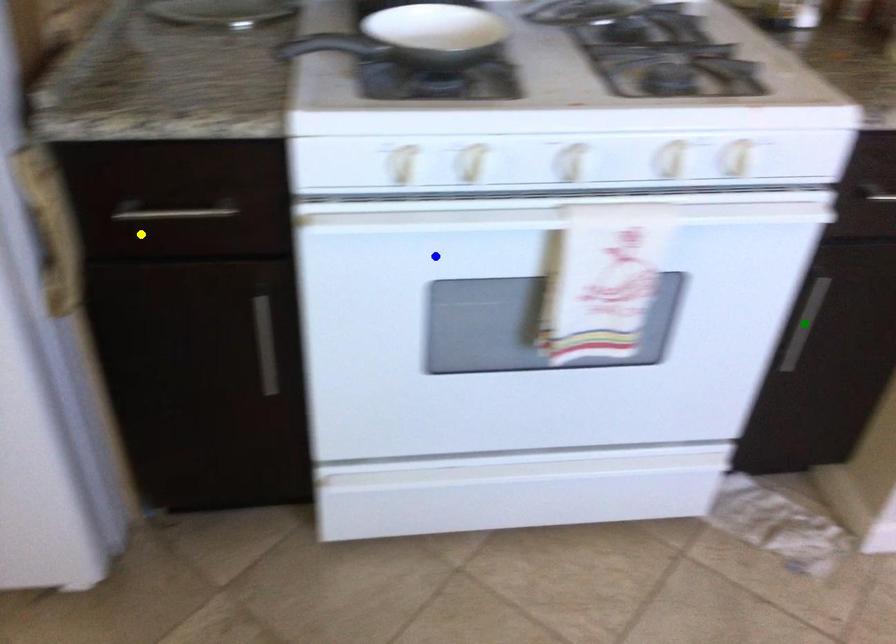
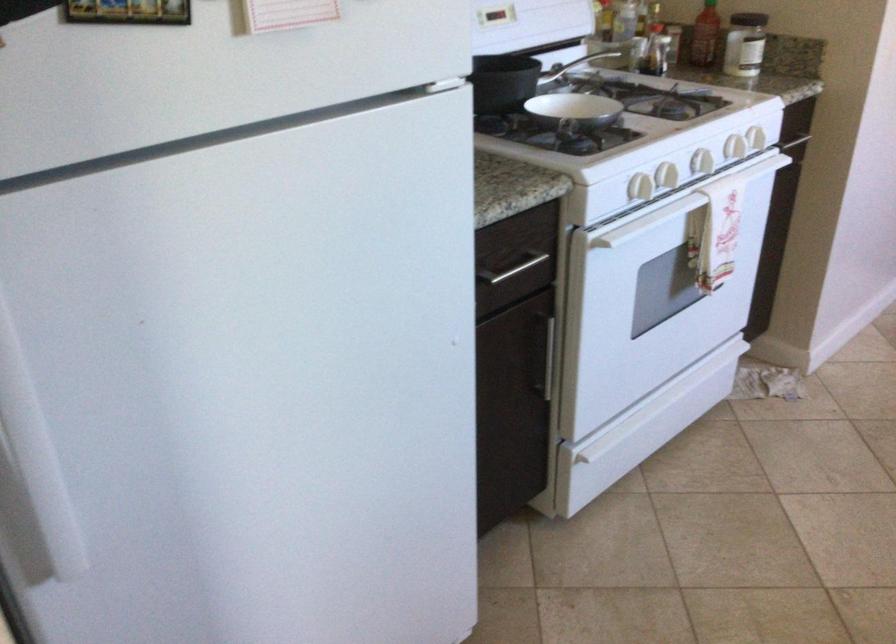
I am providing you with two images of the same scene from different viewpoints. Three points are marked in image1. Which point corresponds to a part or object that is occluded in image2?In image1, three points are marked. Which of them correspond to a part or object that is occluded in image2?Among the three points shown in image1, which one corresponds to a part or object that is no longer visible due to occlusion in image2?

green point